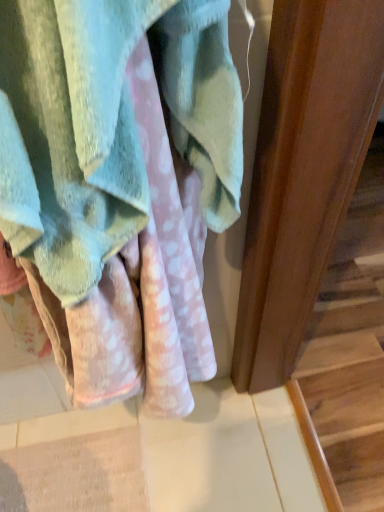
What is the approximate height of soft pink towel at center?

It is 15.46 inches.

What do you see at coordinates (106, 127) in the screenshot?
I see `soft pink towel at center` at bounding box center [106, 127].

The width and height of the screenshot is (384, 512). In order to click on soft pink towel at center in this screenshot , I will do `click(106, 127)`.

What is the approximate width of wooden at right?

wooden at right is 37.22 inches in width.

Measure the distance between wooden at right and camera.

3.52 feet.

You are a GUI agent. You are given a task and a screenshot of the screen. Output one action in this format:
    pyautogui.click(x=<x>, y=<y>)
    Task: Click on the wooden at right
    Image resolution: width=384 pixels, height=512 pixels.
    Given the screenshot: What is the action you would take?
    (352, 346)

The height and width of the screenshot is (512, 384). What do you see at coordinates (352, 346) in the screenshot?
I see `wooden at right` at bounding box center [352, 346].

Where is `soft pink towel at center`? The height and width of the screenshot is (512, 384). soft pink towel at center is located at coordinates (106, 127).

Looking at this image, visually, is wooden at right positioned to the left or to the right of soft pink towel at center?

Clearly, wooden at right is on the right of soft pink towel at center in the image.

Which object is more forward, wooden at right or soft pink towel at center?

soft pink towel at center is closer to the camera.

Which is closer, (337,362) or (192,86)?

Point (337,362) is farther from the camera than point (192,86).

Consider the image. From the image's perspective, is wooden at right positioned above or below soft pink towel at center?

Clearly, from the image's perspective, wooden at right is below soft pink towel at center.

From a real-world perspective, relative to soft pink towel at center, is wooden at right vertically above or below?

wooden at right is below soft pink towel at center.

Between wooden at right and soft pink towel at center, which one has smaller width?

soft pink towel at center.

Between wooden at right and soft pink towel at center, which one has less height?

wooden at right.

Is wooden at right bigger than soft pink towel at center?

Yes, wooden at right is bigger than soft pink towel at center.

Is soft pink towel at center surrounded by wooden at right?

No, soft pink towel at center is not surrounded by wooden at right.

Is wooden at right not near soft pink towel at center?

That's right, there is a large distance between wooden at right and soft pink towel at center.

Does wooden at right turn towards soft pink towel at center?

No, wooden at right is not aimed at soft pink towel at center.

How far apart are wooden at right and soft pink towel at center?

They are 3.45 feet apart.

Where is `stairwell behind the soft pink towel at center`? stairwell behind the soft pink towel at center is located at coordinates (352, 346).

Would you say soft pink towel at center is to the left or to the right of wooden at right in the picture?

Clearly, soft pink towel at center is on the left of wooden at right in the image.

Considering the positions of objects soft pink towel at center and wooden at right in the image provided, who is behind, soft pink towel at center or wooden at right?

wooden at right is behind.

Which is more distant, [216,168] or [332,346]?

The point [332,346] is more distant.

From the image's perspective, between soft pink towel at center and wooden at right, which one is located above?

soft pink towel at center, from the image's perspective.

From a real-world perspective, between soft pink towel at center and wooden at right, who is vertically higher?

soft pink towel at center, from a real-world perspective.

Considering the sizes of objects soft pink towel at center and wooden at right in the image provided, who is thinner, soft pink towel at center or wooden at right?

soft pink towel at center.

Considering the relative sizes of soft pink towel at center and wooden at right in the image provided, is soft pink towel at center shorter than wooden at right?

Incorrect, the height of soft pink towel at center does not fall short of that of wooden at right.

Considering the relative sizes of soft pink towel at center and wooden at right in the image provided, is soft pink towel at center bigger than wooden at right?

Actually, soft pink towel at center might be smaller than wooden at right.

Is soft pink towel at center surrounding wooden at right?

No, wooden at right is not a part of soft pink towel at center.

Is soft pink towel at center beside wooden at right?

soft pink towel at center is not next to wooden at right, and they're not touching.

Is soft pink towel at center looking in the opposite direction of wooden at right?

No.

How many degrees apart are the facing directions of soft pink towel at center and wooden at right?

soft pink towel at center and wooden at right are facing 89.1 degrees away from each other.

Identify the location of stairwell behind the soft pink towel at center. (352, 346).

The width and height of the screenshot is (384, 512). In order to click on towel above the wooden at right (from a real-world perspective) in this screenshot , I will do `click(106, 127)`.

Locate an element on the screen. towel in front of the wooden at right is located at coordinates (106, 127).